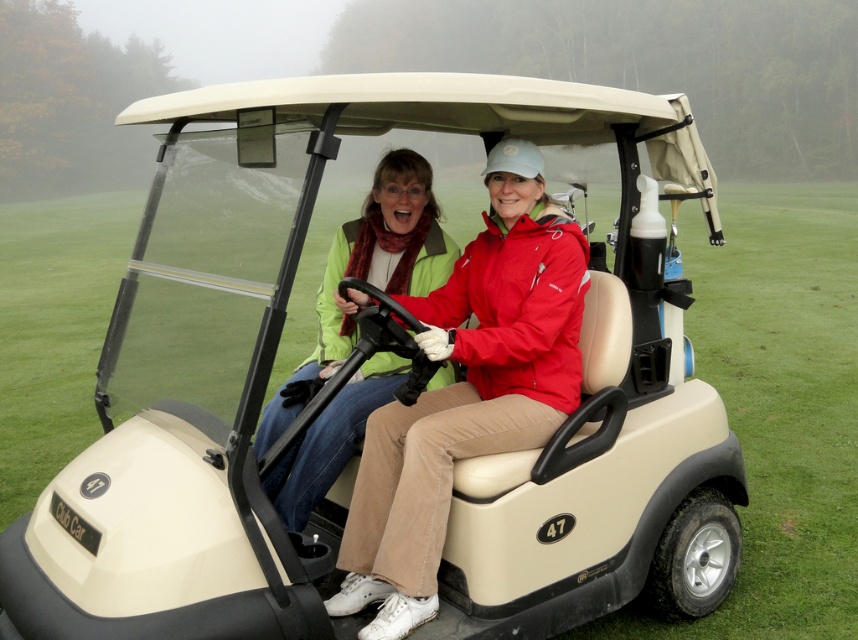
Based on the photo, you are standing at the point with coordinates point (353, 451) and want to walk to point (445, 288). Which direction should you face to walk towards your destination?

You should face north because point (445, 288) is behind point (353, 451).

You are trying to distinguish between two similar green jackets in the image. The driver is wearing a red jacket, while the passenger has two green jackets. Which one is taller, the matte green jacket at center or the green matte jacket at center?

The matte green jacket at center is taller than the green matte jacket at center.

You are a fashion designer analyzing the image of two people in a golf cart. You notice two jackets labeled as matte green jacket at center and green matte jacket at center. Which one is bigger?

The matte green jacket at center is larger in size than the green matte jacket at center.